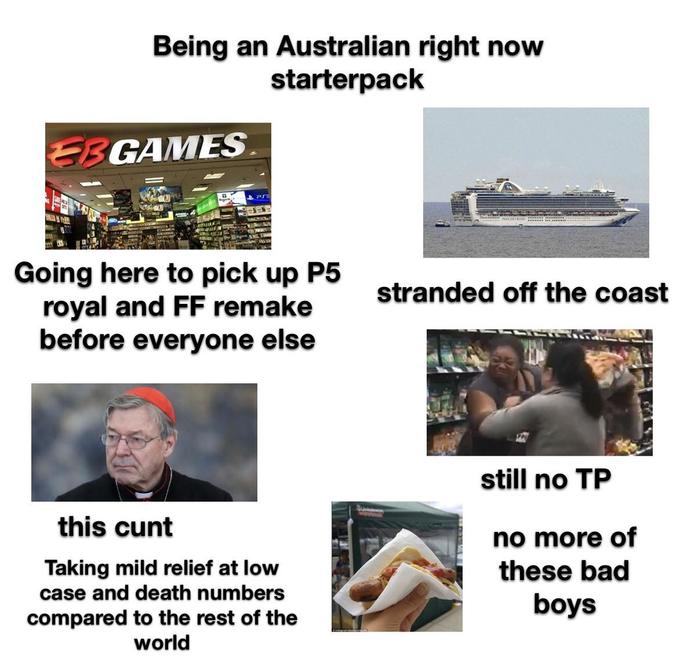
Find the location of a particular element. This screenshot has width=680, height=660. shelves is located at coordinates (222, 232).